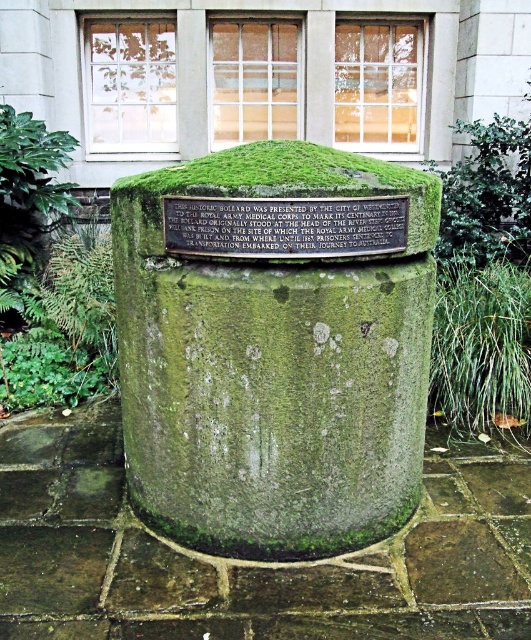
Identify the location of green mossy stone pillar at center. (275, 346).

Can you confirm if green mossy stone pillar at center is positioned to the right of green mossy stone plaque at center?

No, green mossy stone pillar at center is not to the right of green mossy stone plaque at center.

You are a GUI agent. You are given a task and a screenshot of the screen. Output one action in this format:
    pyautogui.click(x=<x>, y=<y>)
    Task: Click on the green mossy stone pillar at center
    The image size is (531, 640).
    Given the screenshot: What is the action you would take?
    (x=275, y=346)